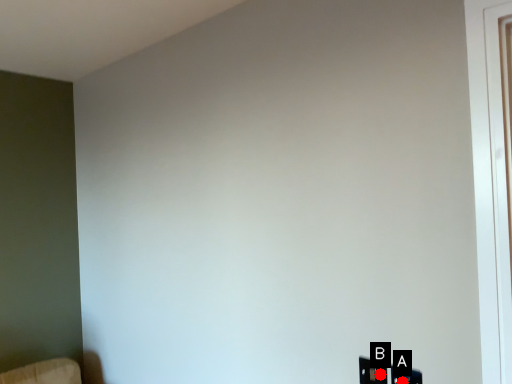
Question: Two points are circled on the image, labeled by A and B beside each circle. Which point is farther from the camera taking this photo?

Choices:
 (A) A is further
 (B) B is further

Answer: (B)